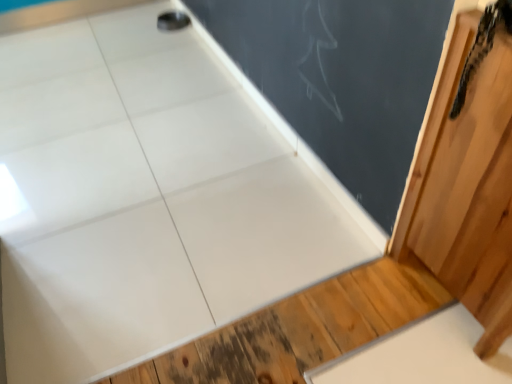
This screenshot has width=512, height=384. Find the location of `vacant space underneath wooden barn door at right (from a real-world perspective)`. vacant space underneath wooden barn door at right (from a real-world perspective) is located at coordinates (442, 311).